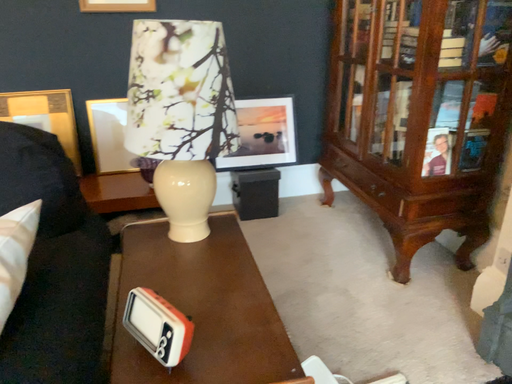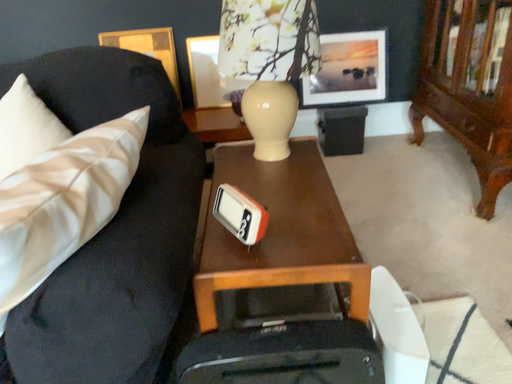
Question: Which way did the camera rotate in the video?

Choices:
 (A) rotated downward
 (B) rotated upward

Answer: (A)